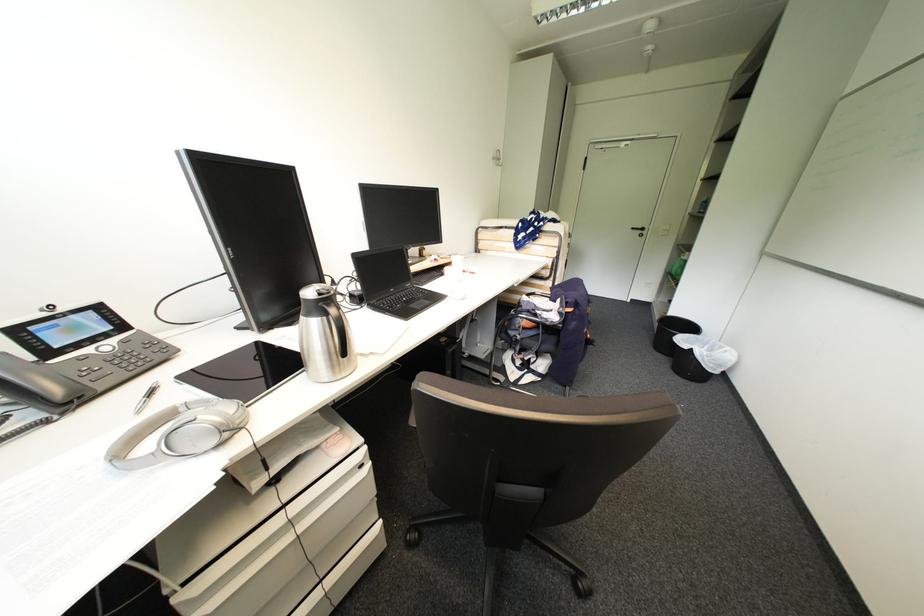
The height and width of the screenshot is (616, 924). What do you see at coordinates (38, 379) in the screenshot?
I see `a phone handset` at bounding box center [38, 379].